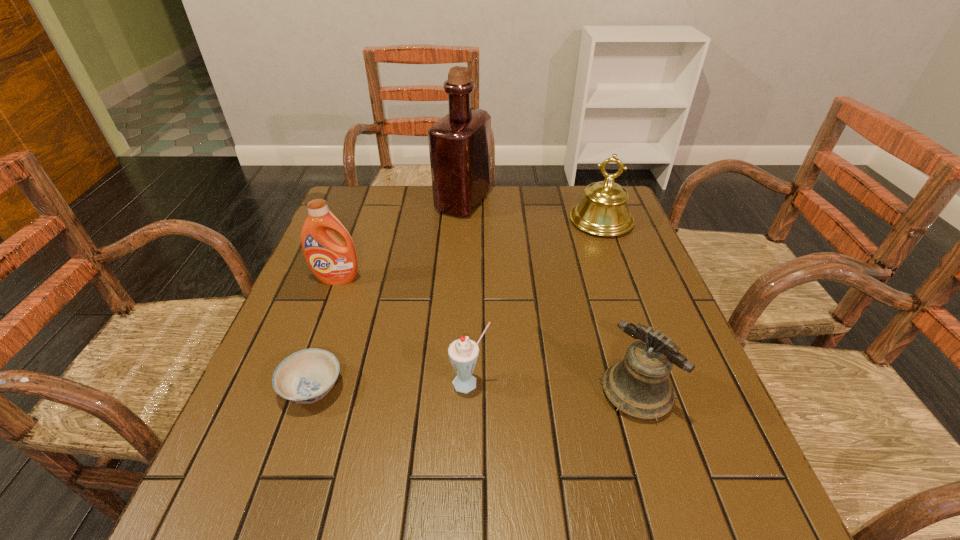
Identify the location of free spot located 0.190m on the straw side of the milkshake. (468, 496).

Image resolution: width=960 pixels, height=540 pixels. I want to click on vacant point located 0.190m on the front of the bowl, so click(x=266, y=525).

Locate an element on the screen. The image size is (960, 540). liquor at the far edge is located at coordinates (459, 144).

Find the location of a particular element. The width and height of the screenshot is (960, 540). bell located in the far edge section of the desktop is located at coordinates (603, 211).

The height and width of the screenshot is (540, 960). I want to click on detergent that is at the left edge, so click(333, 262).

I want to click on bowl that is positioned at the left edge, so click(x=306, y=376).

Locate an element on the screen. The height and width of the screenshot is (540, 960). object present at the far right corner is located at coordinates (603, 211).

You are a GUI agent. You are given a task and a screenshot of the screen. Output one action in this format:
    pyautogui.click(x=<x>, y=<y>)
    Task: Click on the vacant space at the far edge of the desktop
    The height and width of the screenshot is (540, 960).
    Given the screenshot: What is the action you would take?
    pyautogui.click(x=545, y=186)

Find the location of a particular element. The image size is (960, 540). vacant space at the near edge is located at coordinates (491, 485).

At what (x,y) coordinates should I click in order to perform the action: click on free space at the left edge of the desktop. Please return your answer as a coordinate pair (x, y). Looking at the image, I should click on (340, 294).